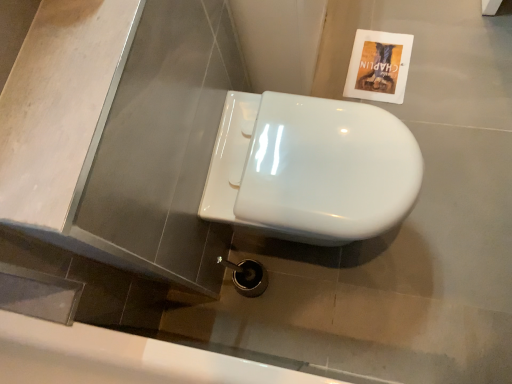
This screenshot has height=384, width=512. Find the location of `vacant area to the right of matte paper flyer at upper right`. vacant area to the right of matte paper flyer at upper right is located at coordinates (437, 41).